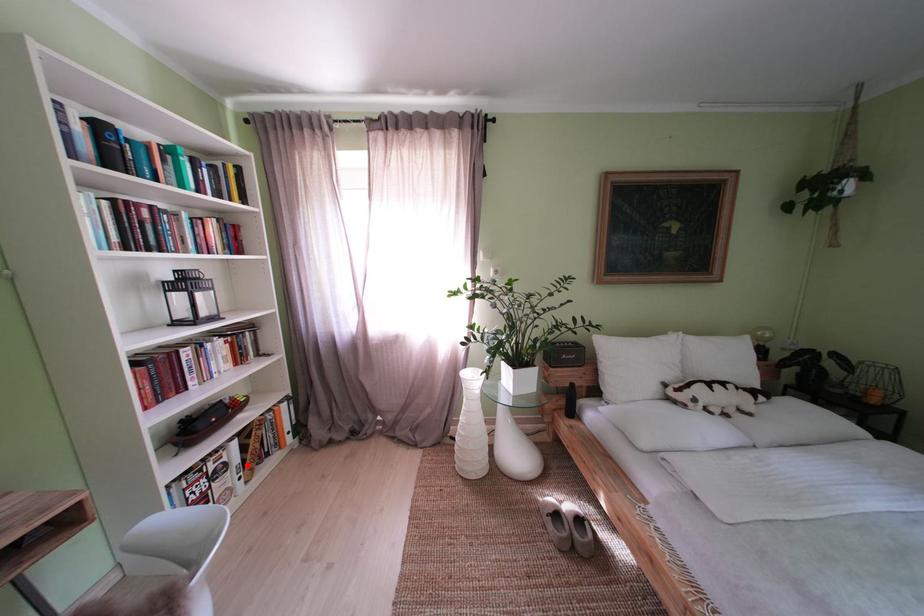
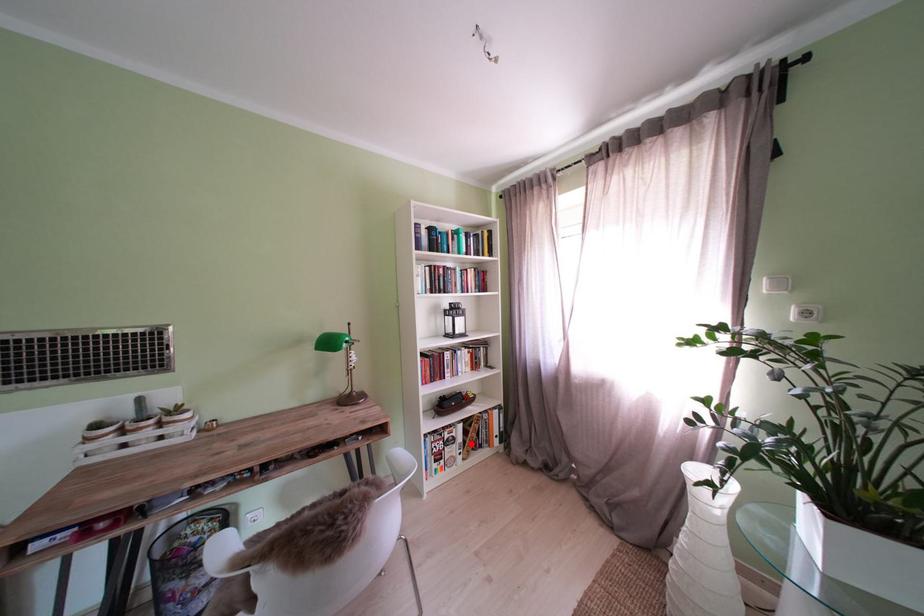
I am providing you with two images of the same scene from different viewpoints. A red point is marked on the first image and another point is marked on the second image. Are the points marked in image1 and image2 representing the same 3D position?

Yes